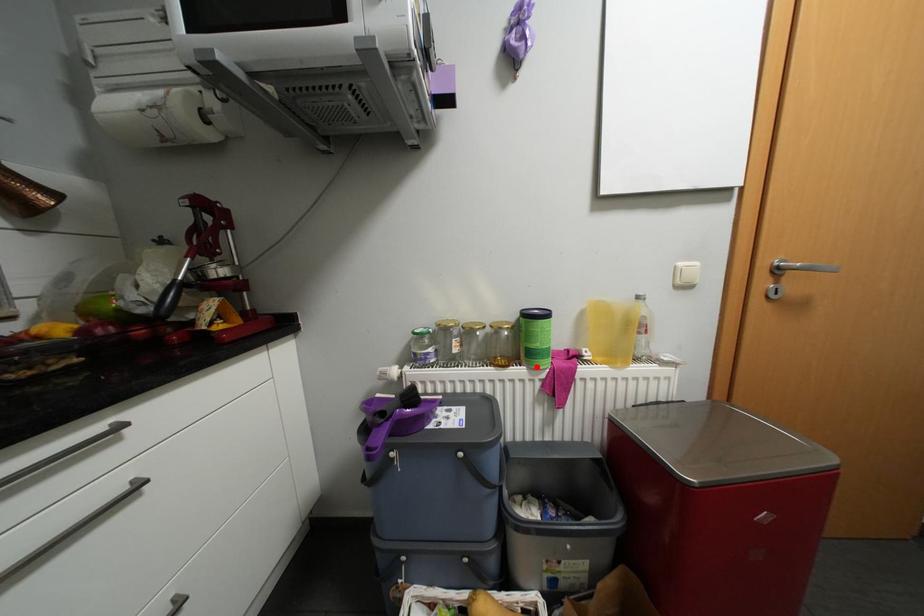
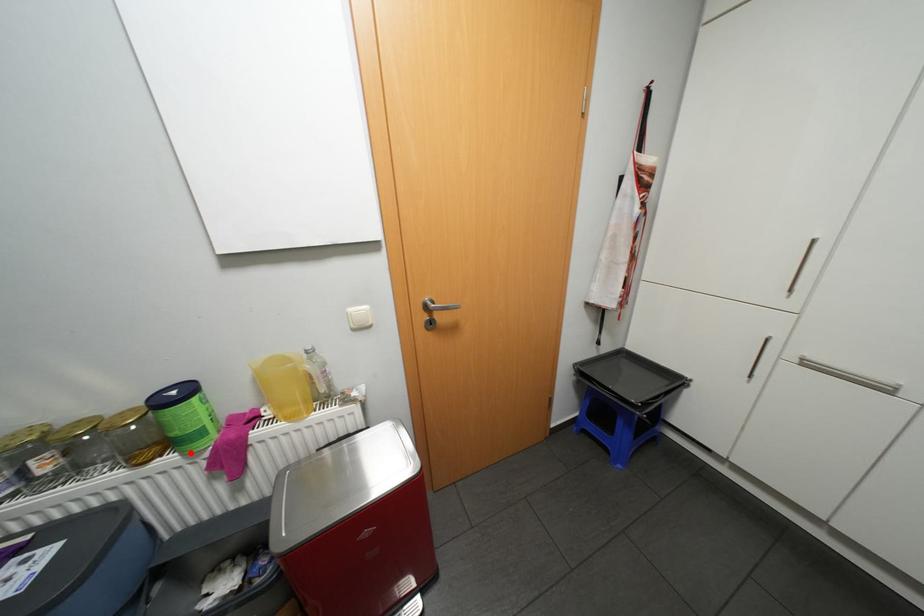
I am providing you with two images of the same scene from different viewpoints. A red point is marked on the first image and another point is marked on the second image. Does the point marked in image1 correspond to the same location as the one in image2?

Yes